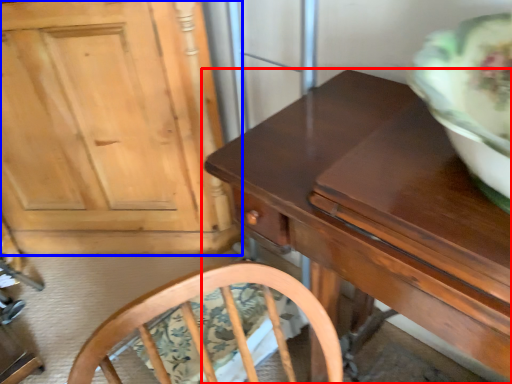
Question: Among these objects, which one is nearest to the camera, table (highlighted by a red box) or cabinetry (highlighted by a blue box)?

Choices:
 (A) table
 (B) cabinetry

Answer: (A)